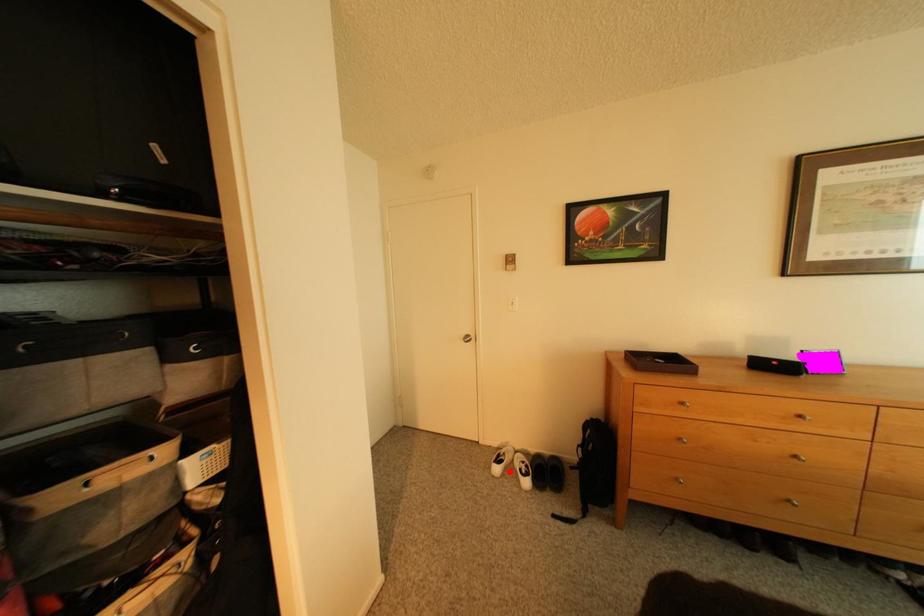
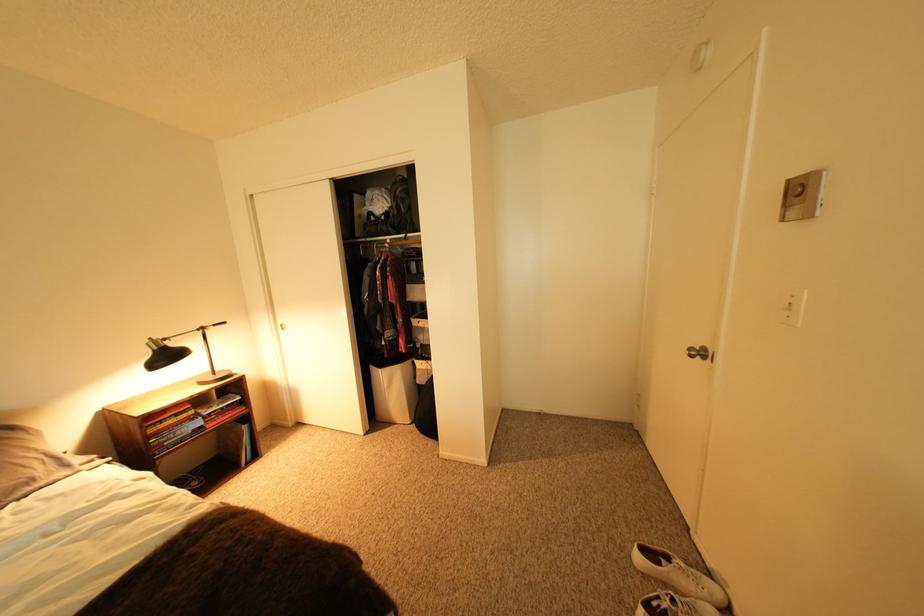
Question: A red point is marked in image1. In image2, is the corresponding 3D point closer to the camera or farther? Reply with the corresponding letter.

Choices:
 (A) The corresponding 3D point is closer.
 (B) The corresponding 3D point is farther.

Answer: (B)